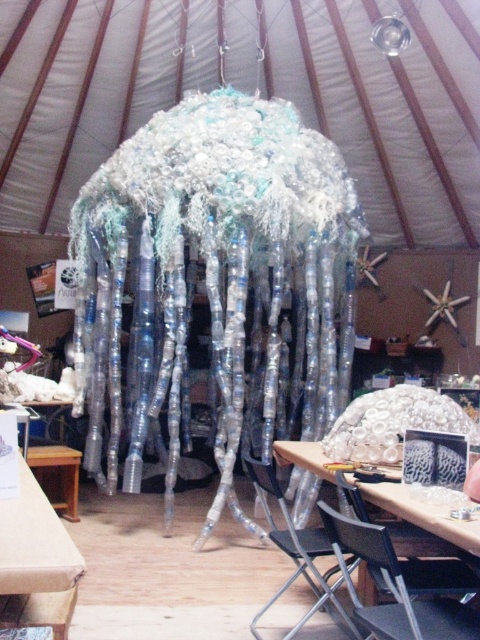
From the picture: Can you confirm if black plastic chair at lower center is positioned above metallic silver chair at lower center?

Yes.

Locate an element on the screen. The height and width of the screenshot is (640, 480). black plastic chair at lower center is located at coordinates (394, 588).

You are a GUI agent. You are given a task and a screenshot of the screen. Output one action in this format:
    pyautogui.click(x=<x>, y=<y>)
    Task: Click on the black plastic chair at lower center
    This screenshot has height=640, width=480.
    Given the screenshot: What is the action you would take?
    pyautogui.click(x=394, y=588)

Measure the distance from metallic silver chair at lower center to wooden table at lower left.

metallic silver chair at lower center is 5.35 feet away from wooden table at lower left.

Is the position of metallic silver chair at lower center more distant than that of wooden table at lower left?

No.

At what (x,y) coordinates should I click in order to perform the action: click on metallic silver chair at lower center. Please return your answer as a coordinate pair (x, y). The image size is (480, 640). Looking at the image, I should click on (297, 550).

Find the location of a particular element. This screenshot has height=640, width=480. metallic silver chair at lower center is located at coordinates (297, 550).

Between black plastic chair at lower center and wooden table at lower left, which one is positioned higher?

Positioned higher is black plastic chair at lower center.

Which of these two, black plastic chair at lower center or wooden table at lower left, stands taller?

With more height is black plastic chair at lower center.

Is point (419, 612) closer to viewer compared to point (56, 506)?

Yes, point (419, 612) is in front of point (56, 506).

Find the location of `black plastic chair at lower center`. black plastic chair at lower center is located at coordinates (394, 588).